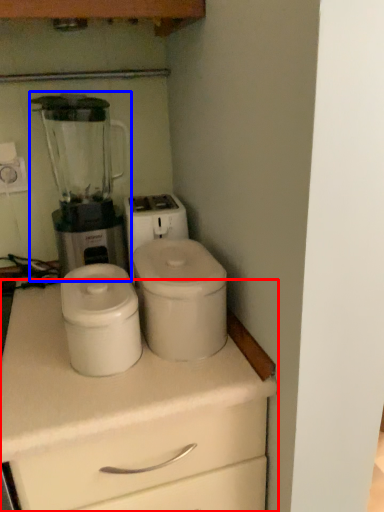
Question: Which object appears farthest to the camera in this image, chest of drawers (highlighted by a red box) or blender (highlighted by a blue box)?

Choices:
 (A) chest of drawers
 (B) blender

Answer: (B)